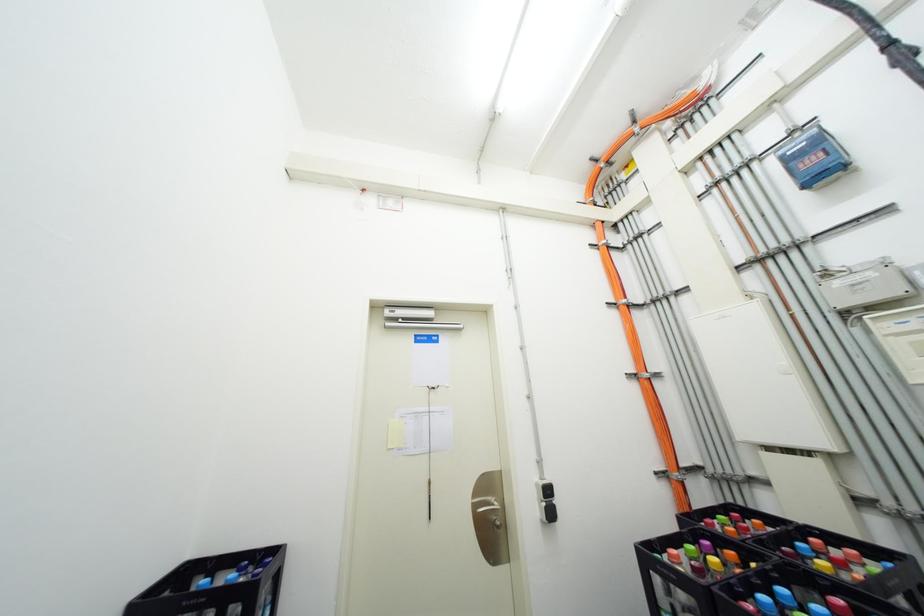
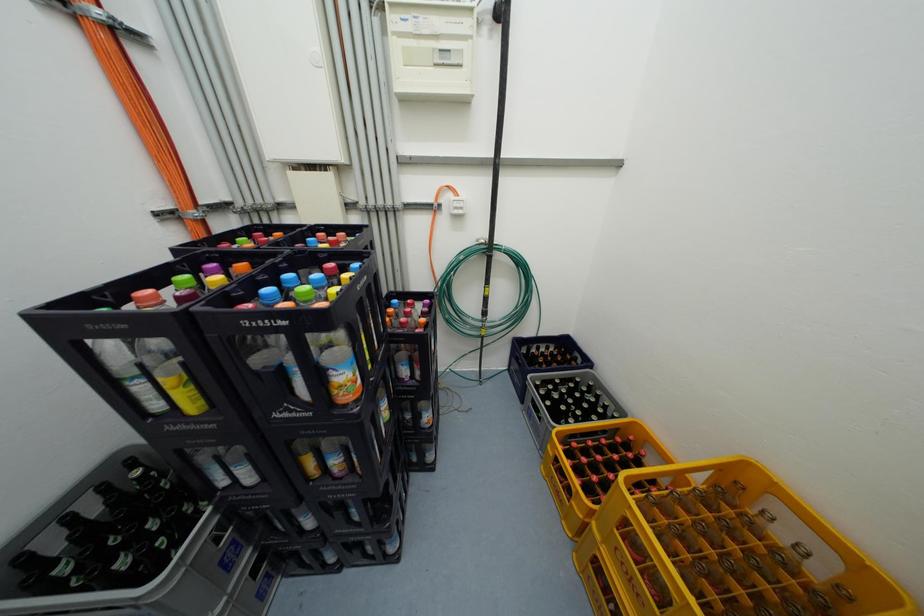
The first image is from the beginning of the video and the second image is from the end. How did the camera likely rotate when shooting the video?

The camera's rotation is toward right-down.